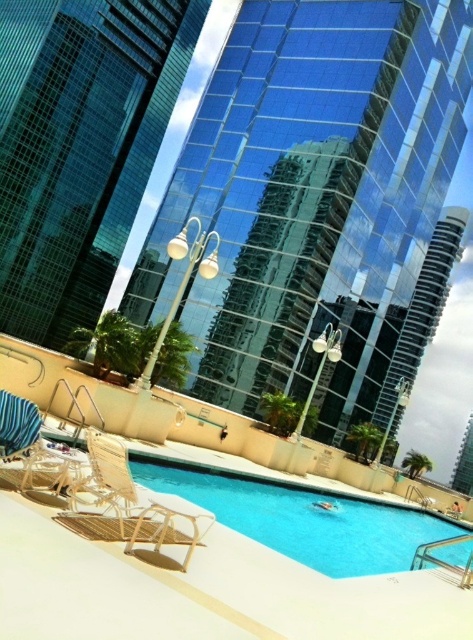
You are planning to place a beige woven beach chair at lower left next to the blue glossy water at center. Based on their widths, which object would occupy more horizontal space?

The blue glossy water at center has a greater width than the beige woven beach chair at lower left, so it would occupy more horizontal space.

You are a drone operator tasked with capturing aerial footage of the urban swimming pool area. Your drone has a maximum flight range of 30 meters from its starting position. If you position the drone at the transparent glass building at center, will it be able to fly to the glassy blue building at upper left without exceeding its range?

The distance between the transparent glass building at center and the glassy blue building at upper left is 28.40 meters. Since the drone has a maximum range of 30 meters, it can safely fly from the transparent glass building at center to the glassy blue building at upper left without exceeding its range.